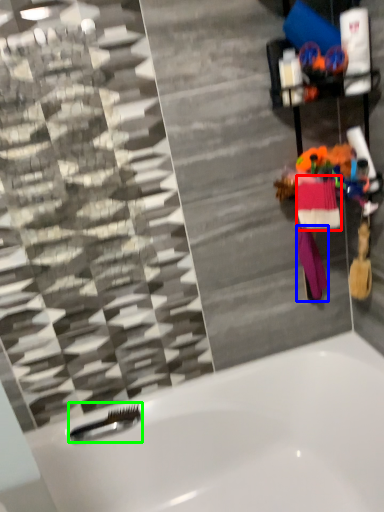
Question: Which object is the closest to the clothing (highlighted by a red box)? Choose among these: clothing (highlighted by a blue box) or shower (highlighted by a green box).

Choices:
 (A) clothing
 (B) shower

Answer: (A)